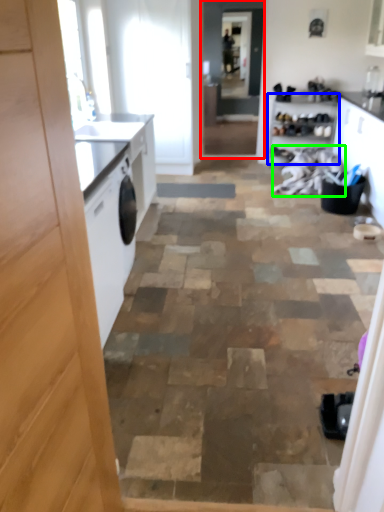
Question: Based on their relative distances, which object is farther from screen door (highlighted by a red box)? Choose from cabinetry (highlighted by a blue box) and laundry (highlighted by a green box).

Choices:
 (A) cabinetry
 (B) laundry

Answer: (B)